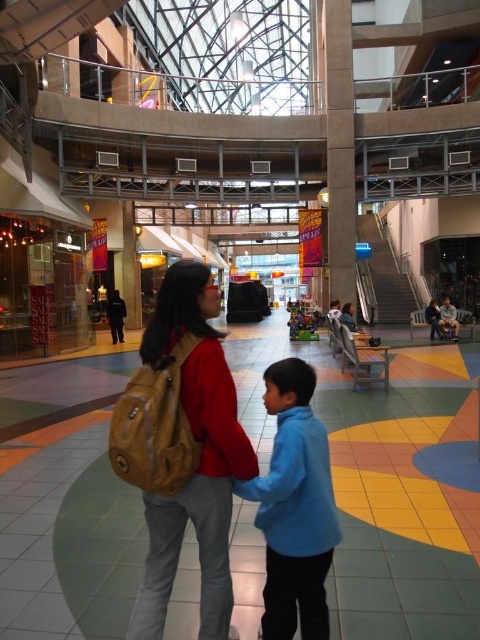
You are a security guard at the mall and need to ensure that the leather backpack at center and the blue fleece jacket at center can both fit through a narrow security checkpoint that is 50 cm wide. Which item might not fit through the checkpoint?

The leather backpack at center has a larger width than the blue fleece jacket at center. Since the checkpoint is 50 cm wide, the leather backpack at center might not fit through the checkpoint if its width exceeds 50 cm.

You are standing in the mall atrium and see the leather backpack at center and the blue fleece jacket at center. Which object is positioned more to the left?

The leather backpack at center is positioned to the left of the blue fleece jacket at center, so it is more to the left.

Based on the photo, you are a security guard in the mall and need to monitor the two people in the scene. Which object is closer to you between the leather backpack at center and the blue fleece jacket at center?

The leather backpack at center is closer to you because the blue fleece jacket at center is positioned behind it.